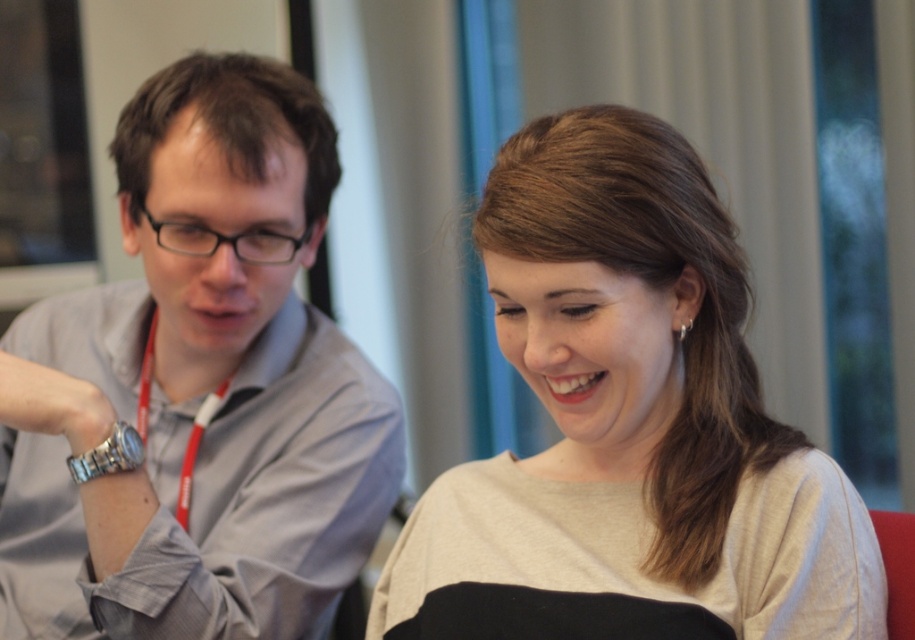
You are trying to decide which clothing item to take from the scene. The gray fabric shirt at left and the light beige sweater at center are both on the table. Which one is closer to the edge of the table?

The gray fabric shirt at left is positioned on the left side of the light beige sweater at center, so it is closer to the left edge of the table.

You are a photographer standing 10 feet away from the two people in the scene. You want to take a photo that includes both the gray fabric shirt at left and the light beige sweater at center without any part of them being cut off. What is the minimum width of the camera lens you need to capture both items in full?

The gray fabric shirt at left is 15.20 inches from the light beige sweater at center. To capture both items without any part being cut off, the camera lens must have a minimum width of at least 15.20 inches.

You are a photographer trying to capture a candid shot of both the gray fabric shirt at left and the light beige sweater at center. Since you want to ensure both are fully visible in the frame, which item should you position closer to the camera to avoid blocking?

The light beige sweater at center is behind the gray fabric shirt at left, so you should position the gray fabric shirt at left closer to the camera to prevent it from blocking the light beige sweater at center.